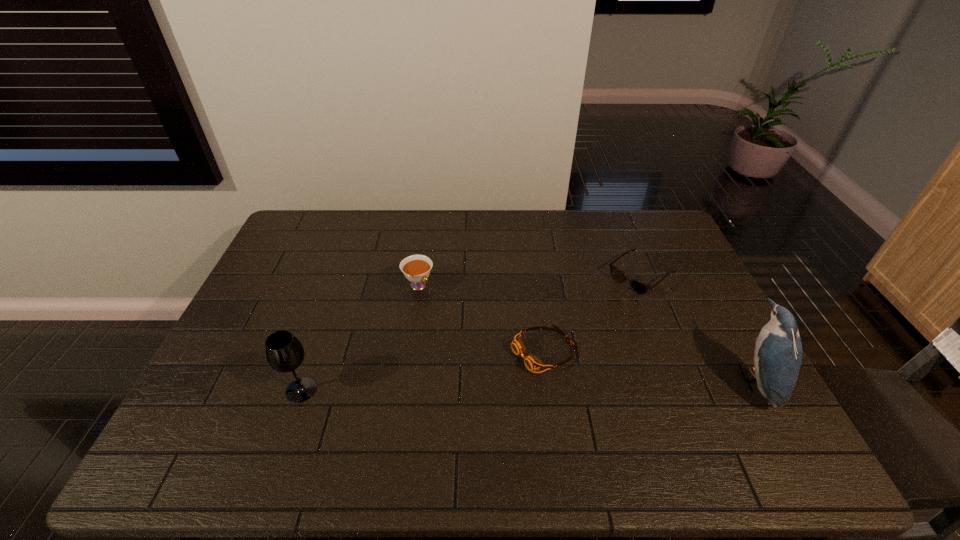
The width and height of the screenshot is (960, 540). I want to click on the second tallest object, so click(284, 352).

This screenshot has height=540, width=960. I want to click on wineglass, so click(284, 352).

Find the location of a particular element. the rightmost object is located at coordinates (778, 349).

Locate an element on the screen. This screenshot has width=960, height=540. the tallest object is located at coordinates (778, 349).

At what (x,y) coordinates should I click in order to perform the action: click on sunglasses. Please return your answer as a coordinate pair (x, y). Looking at the image, I should click on (640, 288).

Where is `the second object from left to right`? This screenshot has height=540, width=960. the second object from left to right is located at coordinates (416, 268).

Identify the location of teacup. (416, 268).

This screenshot has width=960, height=540. Identify the location of goggles. (532, 363).

This screenshot has height=540, width=960. In order to click on free region located on the right of the leftmost object in this screenshot , I will do `click(453, 390)`.

What are the coordinates of `blank area located 0.150m at the tip of the rightmost object's beak` in the screenshot? It's located at (679, 380).